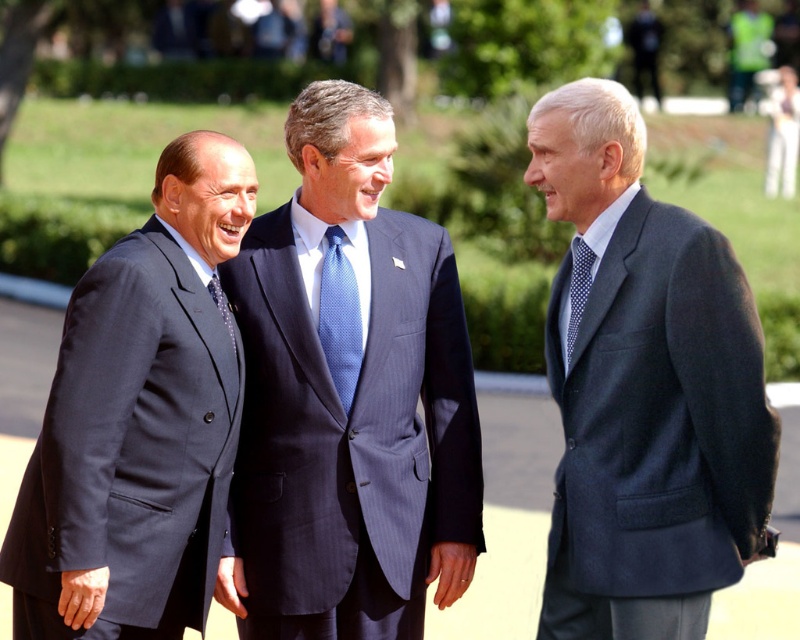
Does polka dot silk tie at center appear over matte black tie at center?

Indeed, polka dot silk tie at center is positioned over matte black tie at center.

Does polka dot silk tie at center appear on the left side of matte black tie at center?

Incorrect, polka dot silk tie at center is not on the left side of matte black tie at center.

Describe the element at coordinates (578, 289) in the screenshot. I see `polka dot silk tie at center` at that location.

The height and width of the screenshot is (640, 800). I want to click on polka dot silk tie at center, so click(578, 289).

Can you confirm if blue pinstripe suit at center is positioned to the left of polka dot silk tie at center?

Correct, you'll find blue pinstripe suit at center to the left of polka dot silk tie at center.

Which is behind, point (290, 368) or point (574, 342)?

Positioned behind is point (290, 368).

The height and width of the screenshot is (640, 800). What are the coordinates of `blue pinstripe suit at center` in the screenshot? It's located at (348, 396).

Does dark gray wool suit at right have a lesser width compared to blue dotted tie at center?

No.

Can you confirm if dark gray wool suit at right is taller than blue dotted tie at center?

Correct, dark gray wool suit at right is much taller as blue dotted tie at center.

Which is in front, point (636, 266) or point (330, 326)?

Positioned in front is point (636, 266).

This screenshot has height=640, width=800. Find the location of `dark gray wool suit at right`. dark gray wool suit at right is located at coordinates (644, 388).